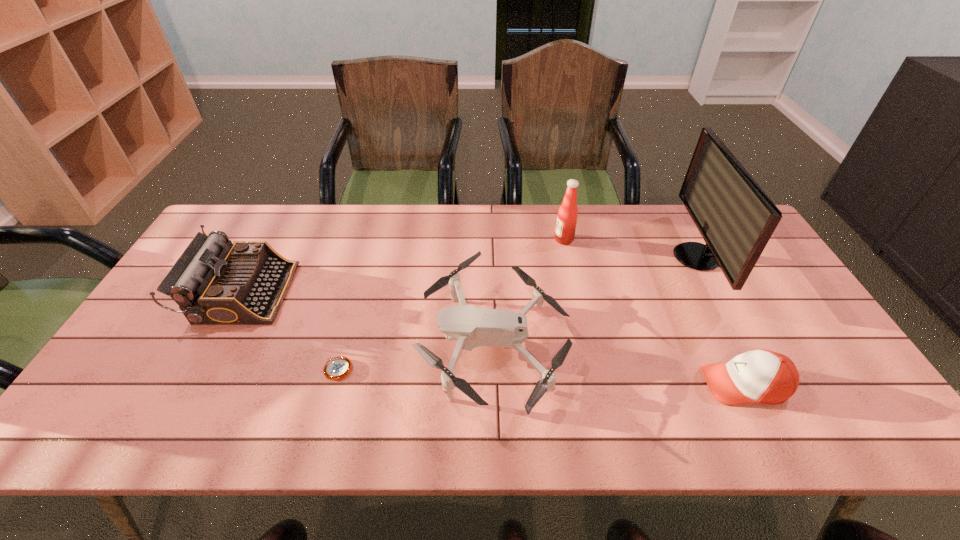
You are a GUI agent. You are given a task and a screenshot of the screen. Output one action in this format:
    pyautogui.click(x=<x>, y=<y>)
    Task: Click on the vacant space situated 0.180m on the front-facing side of the computer monitor
    This screenshot has height=540, width=960.
    Given the screenshot: What is the action you would take?
    pyautogui.click(x=616, y=257)

Image resolution: width=960 pixels, height=540 pixels. What are the coordinates of `vacant space situated on the front-facing side of the computer monitor` in the screenshot? It's located at (601, 257).

At what (x,y) coordinates should I click in order to perform the action: click on free space located on the front-facing side of the condiment. Please return your answer as a coordinate pair (x, y). Image resolution: width=960 pixels, height=540 pixels. Looking at the image, I should click on (512, 240).

At what (x,y) coordinates should I click in order to perform the action: click on free space located 0.190m on the front-facing side of the condiment. Please return your answer as a coordinate pair (x, y). The width and height of the screenshot is (960, 540). Looking at the image, I should click on (496, 240).

The image size is (960, 540). I want to click on free space located on the front-facing side of the condiment, so click(x=454, y=240).

The width and height of the screenshot is (960, 540). In order to click on vacant region located 0.170m on the keyboard of the typewriter in this screenshot , I will do `click(348, 293)`.

Find the location of a particular element. The height and width of the screenshot is (540, 960). free space located with a camera at the front of the third object from left to right is located at coordinates (280, 343).

Locate an element on the screen. The height and width of the screenshot is (540, 960). vacant space positioned with a camera at the front of the third object from left to right is located at coordinates (269, 343).

Identify the location of free spot located with a camera at the front of the third object from left to right. This screenshot has height=540, width=960. (347, 343).

Where is `vacant point located 0.190m on the front-facing side of the baseball cap`? vacant point located 0.190m on the front-facing side of the baseball cap is located at coordinates (620, 385).